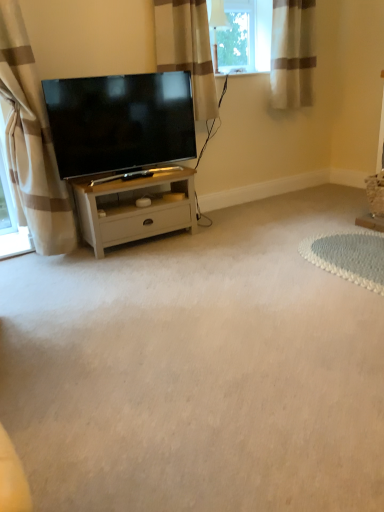
At what (x,y) coordinates should I click in order to perform the action: click on free space in front of beige striped curtain at left, the third curtain when ordered from right to left. Please return your answer as a coordinate pair (x, y). Looking at the image, I should click on (36, 281).